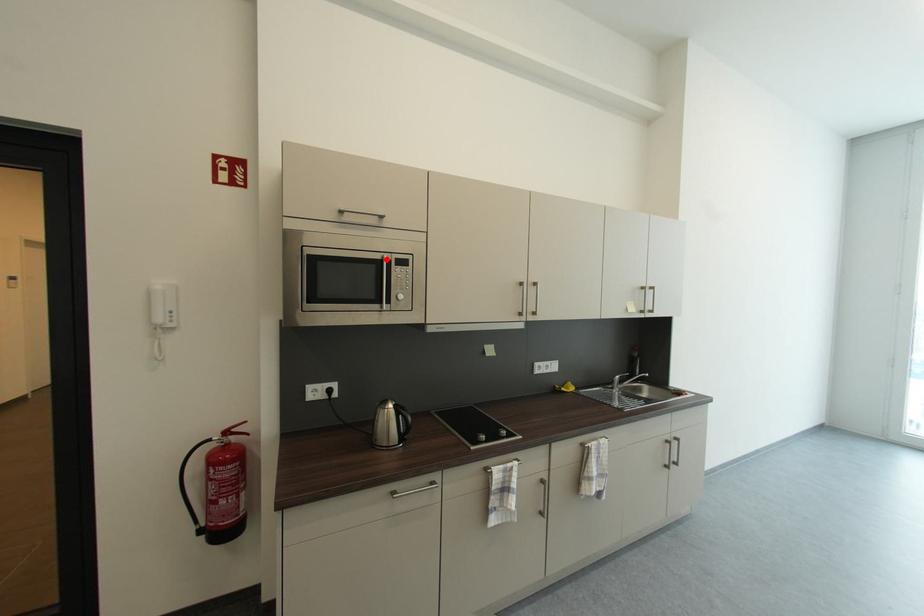
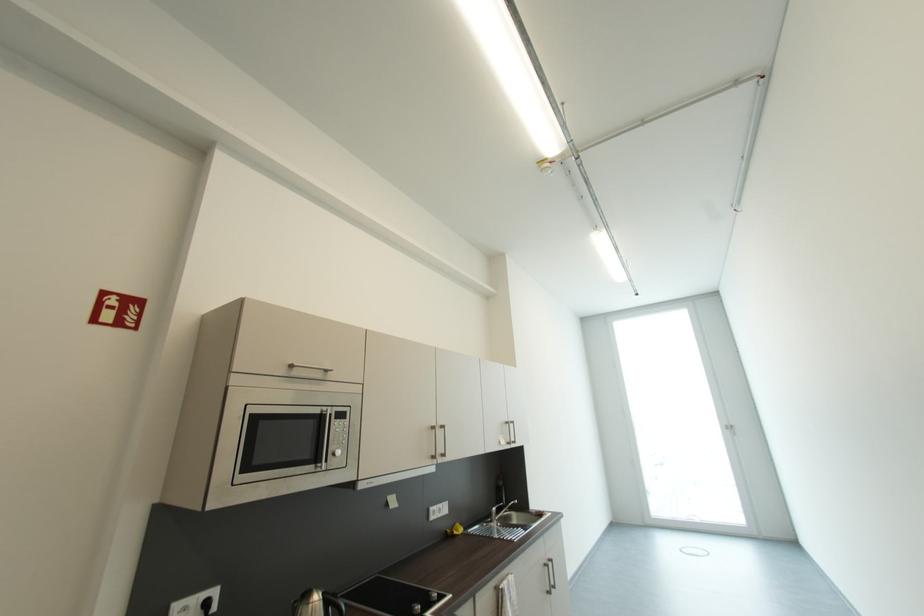
Find the pixel in the second image that matches the highlighted location in the first image.

(325, 413)